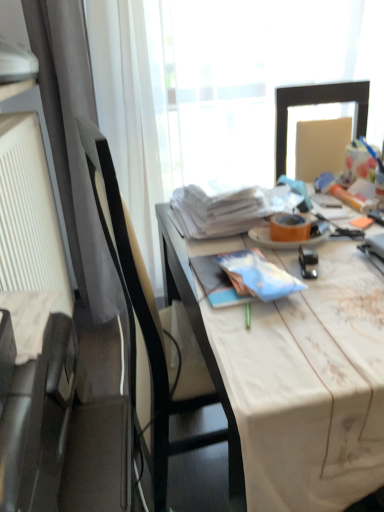
From the picture: What is the approximate height of orange matte plate at center?

1.45 inches.

This screenshot has width=384, height=512. Describe the element at coordinates (293, 377) in the screenshot. I see `white fabric-covered desk at center` at that location.

Find the location of a particular element. Image resolution: width=384 pixels, height=512 pixels. orange matte plate at center is located at coordinates pyautogui.click(x=291, y=241).

Where is `radiator located underneath the metallic black stapler at center-right (from a real-world perspective)`? The image size is (384, 512). radiator located underneath the metallic black stapler at center-right (from a real-world perspective) is located at coordinates (29, 214).

Is white textured radiator at left outside of metallic black stapler at center-right?

Yes, white textured radiator at left is outside of metallic black stapler at center-right.

Who is taller, white fabric-covered desk at center or black leather chair at left?

black leather chair at left is taller.

From a real-world perspective, is white fabric-covered desk at center under black leather chair at left?

Yes, from a real-world perspective, white fabric-covered desk at center is beneath black leather chair at left.

Can you confirm if white fabric-covered desk at center is bigger than black leather chair at left?

Indeed, white fabric-covered desk at center has a larger size compared to black leather chair at left.

Is metallic black stapler at center-right looking in the opposite direction of white textured radiator at left?

metallic black stapler at center-right is not turned away from white textured radiator at left.

Considering the positions of objects metallic black stapler at center-right and white textured radiator at left in the image provided, who is in front, metallic black stapler at center-right or white textured radiator at left?

metallic black stapler at center-right is closer to the camera.

Does metallic black stapler at center-right have a lesser height compared to white textured radiator at left?

Yes, metallic black stapler at center-right is shorter than white textured radiator at left.

Between white textured radiator at left and orange matte plate at center, which one has smaller width?

orange matte plate at center is thinner.

Relative to orange matte plate at center, is white textured radiator at left in front or behind?

white textured radiator at left is positioned closer to the viewer than orange matte plate at center.

Is white textured radiator at left placed right next to orange matte plate at center?

white textured radiator at left is not next to orange matte plate at center, and they're not touching.

Can you confirm if white fabric-covered desk at center is shorter than white textured radiator at left?

Yes, white fabric-covered desk at center is shorter than white textured radiator at left.

Is white fabric-covered desk at center located outside white textured radiator at left?

Absolutely, white fabric-covered desk at center is external to white textured radiator at left.

Is white fabric-covered desk at center positioned with its back to white textured radiator at left?

No, white fabric-covered desk at center is not facing away from white textured radiator at left.

Where is `desk below the white textured radiator at left (from the image's perspective)`? The height and width of the screenshot is (512, 384). desk below the white textured radiator at left (from the image's perspective) is located at coordinates (293, 377).

Which object is more forward, black leather chair at left or metallic black stapler at center-right?

black leather chair at left is closer to the camera.

Would you say black leather chair at left contains metallic black stapler at center-right?

Actually, metallic black stapler at center-right is outside black leather chair at left.

Considering the relative positions of black leather chair at left and metallic black stapler at center-right in the image provided, is black leather chair at left to the right of metallic black stapler at center-right from the viewer's perspective?

Incorrect, black leather chair at left is not on the right side of metallic black stapler at center-right.

What's the angular difference between orange matte plate at center and white fabric-covered desk at center's facing directions?

The angular difference between orange matte plate at center and white fabric-covered desk at center is 3.15 degrees.

Is orange matte plate at center oriented towards white fabric-covered desk at center?

No, orange matte plate at center is not facing towards white fabric-covered desk at center.

Relative to white fabric-covered desk at center, is orange matte plate at center in front or behind?

In the image, orange matte plate at center appears behind white fabric-covered desk at center.

From a real-world perspective, is orange matte plate at center located higher than white fabric-covered desk at center?

Yes, from a real-world perspective, orange matte plate at center is above white fabric-covered desk at center.

Find the location of `radiator below the metallic black stapler at center-right (from the image's perspective)`. radiator below the metallic black stapler at center-right (from the image's perspective) is located at coordinates (29, 214).

The image size is (384, 512). Find the location of `chair that appears behind the white fabric-covered desk at center`. chair that appears behind the white fabric-covered desk at center is located at coordinates (148, 328).

Considering their positions, is orange matte plate at center positioned closer to black leather chair at left than white fabric-covered desk at center?

Based on the image, white fabric-covered desk at center appears to be nearer to black leather chair at left.

Considering their positions, is black leather chair at left positioned further to white textured radiator at left than metallic black stapler at center-right?

Based on the image, metallic black stapler at center-right appears to be further to white textured radiator at left.

Estimate the real-world distances between objects in this image. Which object is closer to metallic black stapler at center-right, white fabric-covered desk at center or white textured radiator at left?

white fabric-covered desk at center lies closer to metallic black stapler at center-right than the other object.

Looking at the image, which one is located closer to orange matte plate at center, metallic black stapler at center-right or white textured radiator at left?

metallic black stapler at center-right is closer to orange matte plate at center.

Which object lies further to the anchor point white fabric-covered desk at center, metallic black stapler at center-right or black leather chair at left?

metallic black stapler at center-right lies further to white fabric-covered desk at center than the other object.

Considering their positions, is black leather chair at left positioned closer to metallic black stapler at center-right than orange matte plate at center?

orange matte plate at center is positioned closer to the anchor metallic black stapler at center-right.

Considering their positions, is orange matte plate at center positioned closer to white fabric-covered desk at center than metallic black stapler at center-right?

Based on the image, metallic black stapler at center-right appears to be nearer to white fabric-covered desk at center.

Which object lies further to the anchor point white textured radiator at left, metallic black stapler at center-right or black leather chair at left?

metallic black stapler at center-right is positioned further to the anchor white textured radiator at left.

Image resolution: width=384 pixels, height=512 pixels. In order to click on plate between black leather chair at left and metallic black stapler at center-right in this screenshot , I will do `click(291, 241)`.

I want to click on plate between white textured radiator at left and metallic black stapler at center-right from left to right, so click(x=291, y=241).

You are a GUI agent. You are given a task and a screenshot of the screen. Output one action in this format:
    pyautogui.click(x=<x>, y=<y>)
    Task: Click on the stationery between white fabric-covered desk at center and orange matte plate at center in the front-back direction
    The width and height of the screenshot is (384, 512).
    Given the screenshot: What is the action you would take?
    pyautogui.click(x=307, y=262)

Where is `chair situated between white textured radiator at left and metallic black stapler at center-right from left to right`? chair situated between white textured radiator at left and metallic black stapler at center-right from left to right is located at coordinates (148, 328).